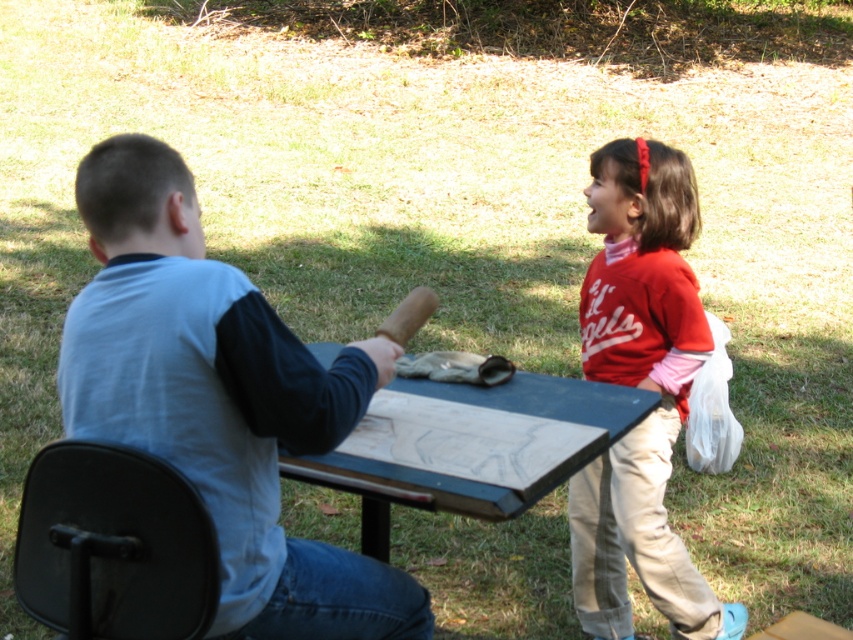
From the picture: Can you confirm if matte red shirt at right is wider than black plastic chair at lower left?

Yes, matte red shirt at right is wider than black plastic chair at lower left.

What do you see at coordinates (640, 388) in the screenshot? I see `matte red shirt at right` at bounding box center [640, 388].

Find the location of a particular element. Image resolution: width=853 pixels, height=640 pixels. matte red shirt at right is located at coordinates (640, 388).

Who is more distant from viewer, (270, 376) or (432, 394)?

The point (432, 394) is more distant.

You are a GUI agent. You are given a task and a screenshot of the screen. Output one action in this format:
    pyautogui.click(x=<x>, y=<y>)
    Task: Click on the light blue cotton shirt at left
    
    Given the screenshot: What is the action you would take?
    pyautogui.click(x=219, y=400)

Can you confirm if matte red shirt at right is positioned below blue painted wood picnic table at center?

Actually, matte red shirt at right is above blue painted wood picnic table at center.

Describe the element at coordinates (640, 388) in the screenshot. I see `matte red shirt at right` at that location.

Image resolution: width=853 pixels, height=640 pixels. What do you see at coordinates (640, 388) in the screenshot?
I see `matte red shirt at right` at bounding box center [640, 388].

You are a GUI agent. You are given a task and a screenshot of the screen. Output one action in this format:
    pyautogui.click(x=<x>, y=<y>)
    Task: Click on the matte red shirt at right
    This screenshot has height=640, width=853.
    Given the screenshot: What is the action you would take?
    pyautogui.click(x=640, y=388)